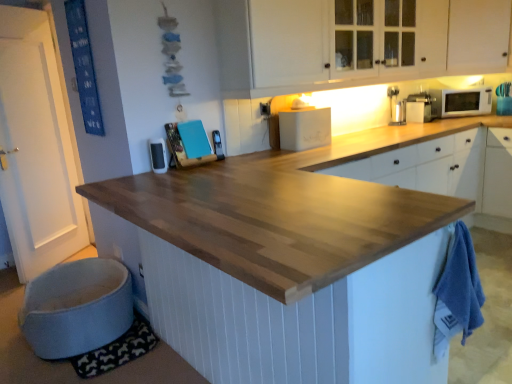
Question: From the image's perspective, is metallic silver phone at center, which is the 3th appliance from right to left, located beneath white matte cabinet at upper right, which appears as the second cabinetry when viewed from the left?

Choices:
 (A) yes
 (B) no

Answer: (A)

Question: Is metallic silver phone at center, which is the 3th appliance from right to left, at the right side of white matte cabinet at upper right, which appears as the second cabinetry when viewed from the left?

Choices:
 (A) no
 (B) yes

Answer: (A)

Question: From a real-world perspective, is metallic silver phone at center, the second appliance from the left, under white matte cabinet at upper right, which appears as the second cabinetry when viewed from the left?

Choices:
 (A) yes
 (B) no

Answer: (A)

Question: Would you say metallic silver phone at center, which is counted as the 3th appliance, starting from the back, is a long distance from white matte cabinet at upper right, which is the first cabinetry in right-to-left order?

Choices:
 (A) no
 (B) yes

Answer: (B)

Question: Does metallic silver phone at center, the second appliance from the left, have a greater width compared to white matte cabinet at upper right, which is the first cabinetry in right-to-left order?

Choices:
 (A) yes
 (B) no

Answer: (B)

Question: From the image's perspective, is metallic silver phone at center, the second appliance from the left, on top of white matte cabinet at upper right, which is the first cabinetry in right-to-left order?

Choices:
 (A) no
 (B) yes

Answer: (A)

Question: Does white matte cabinet at upper right, which is the first cabinetry in right-to-left order, contain white glossy exhaust hood at upper center?

Choices:
 (A) no
 (B) yes

Answer: (A)

Question: Is white glossy exhaust hood at upper center at the back of white matte cabinet at upper right, which is the first cabinetry in right-to-left order?

Choices:
 (A) yes
 (B) no

Answer: (B)

Question: Can we say white matte cabinet at upper right, which appears as the second cabinetry when viewed from the left, lies outside white glossy exhaust hood at upper center?

Choices:
 (A) yes
 (B) no

Answer: (A)

Question: From a real-world perspective, is white matte cabinet at upper right, which appears as the second cabinetry when viewed from the left, located higher than white glossy exhaust hood at upper center?

Choices:
 (A) no
 (B) yes

Answer: (B)

Question: Is white matte cabinet at upper right, which appears as the second cabinetry when viewed from the left, thinner than white glossy exhaust hood at upper center?

Choices:
 (A) no
 (B) yes

Answer: (A)

Question: Is white matte cabinet at upper right, which is the first cabinetry in right-to-left order, positioned far away from white glossy exhaust hood at upper center?

Choices:
 (A) yes
 (B) no

Answer: (B)

Question: Is white glossy microwave at upper right looking in the opposite direction of natural wood countertop at center?

Choices:
 (A) yes
 (B) no

Answer: (B)